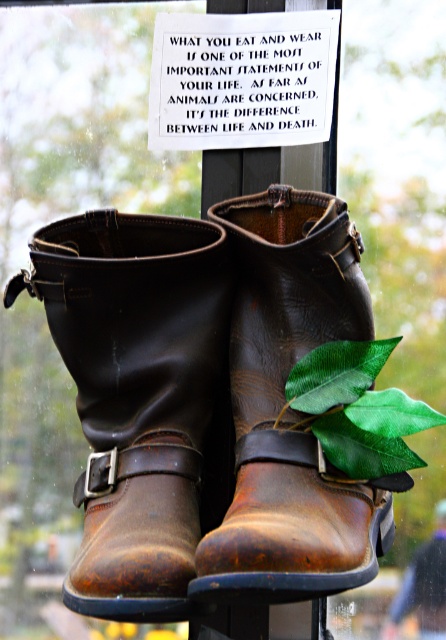
Can you confirm if brown leather cowboy boot at center is bigger than brown leather boot at center?

No, brown leather cowboy boot at center is not bigger than brown leather boot at center.

Does brown leather cowboy boot at center appear over brown leather boot at center?

No.

This screenshot has height=640, width=446. Identify the location of brown leather cowboy boot at center. (136, 394).